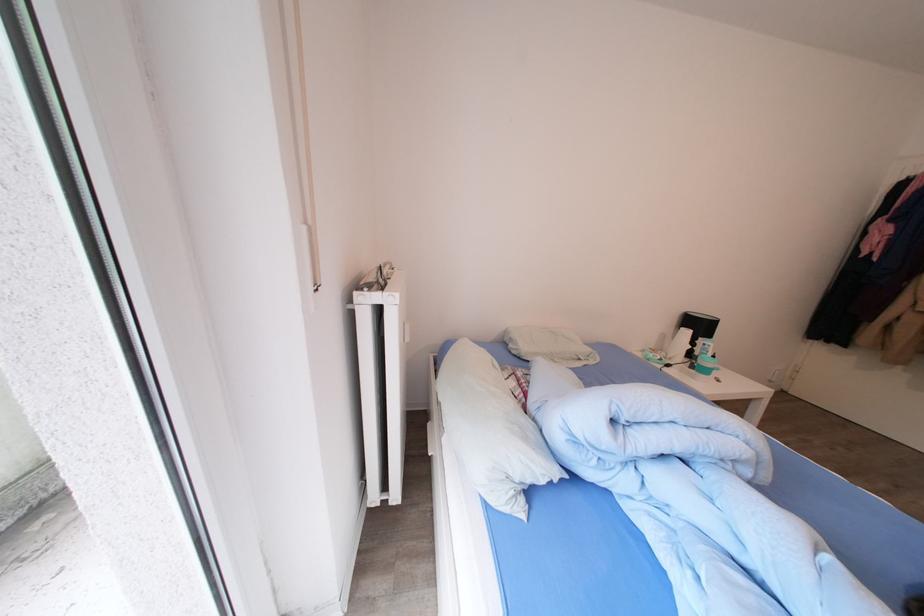
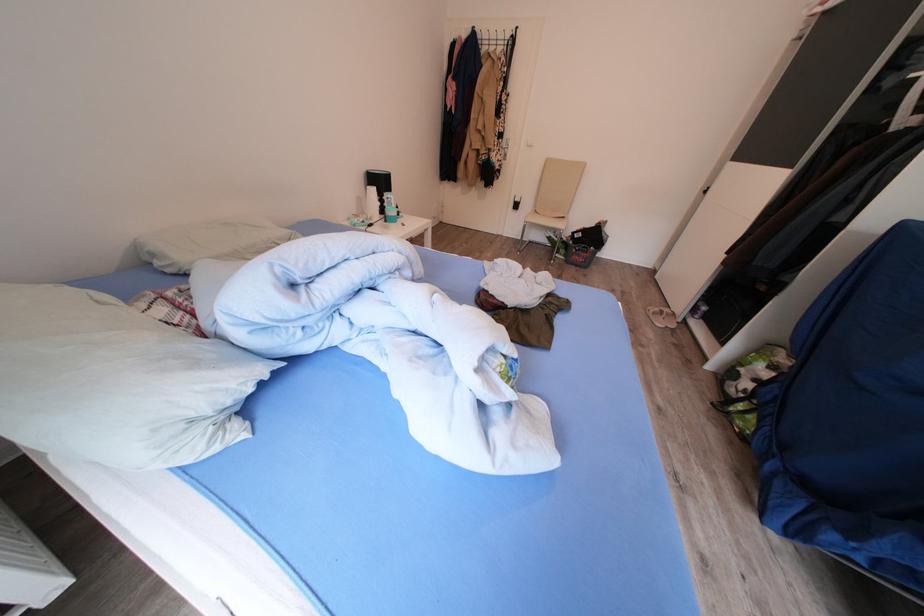
First-person continuous shooting, in which direction is the camera rotating?

The camera's rotation is toward right-down.